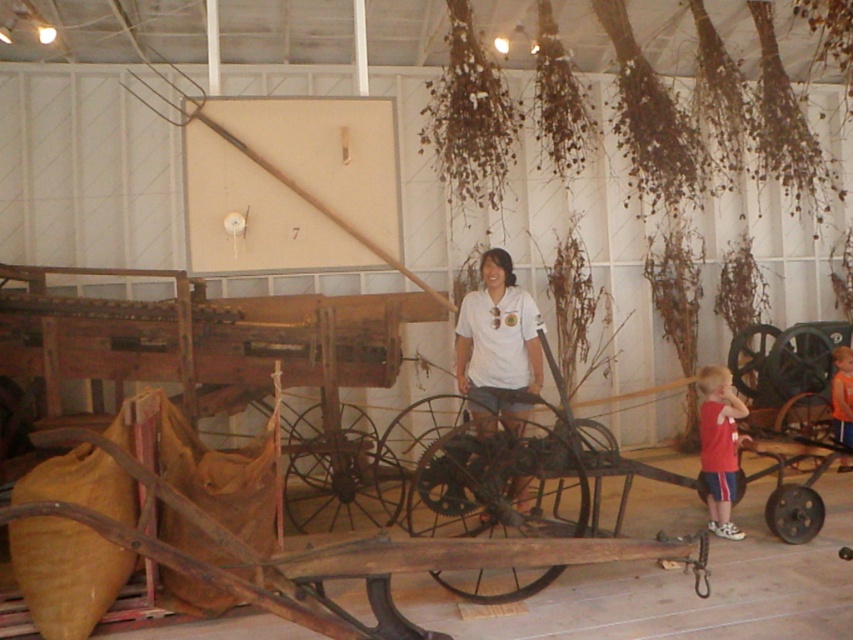
You are standing in front of the historical farming equipment and notice two points marked on the scene. Which of the two points, point (730, 420) or point (839, 465), is closer to you?

Point (730, 420) is closer to the viewer than point (839, 465).

You are a security guard in the museum and need to locate the white matte shirt at center. Where exactly is it positioned in the room?

The white matte shirt at center is positioned at coordinates point (x=497, y=342) in the room.